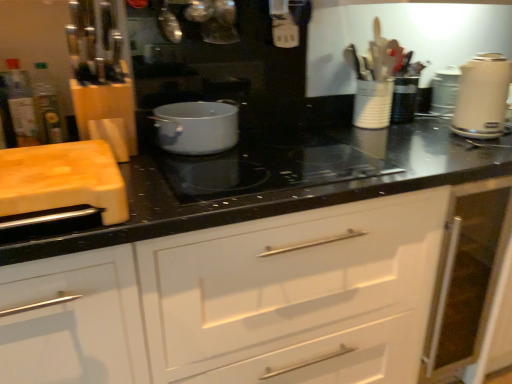
Identify the location of translucent glass bottle at left, the 2th bottle in the left-to-right sequence. The image size is (512, 384). (47, 104).

Identify the location of translucent plastic bottle at left, arranged as the 2th bottle when viewed from the right. This screenshot has width=512, height=384. (21, 105).

This screenshot has height=384, width=512. What do you see at coordinates (169, 24) in the screenshot?
I see `metallic silver kettle at upper center, which appears as the 1th appliance when viewed from the left` at bounding box center [169, 24].

Where is `black glass cooktop at center`? This screenshot has width=512, height=384. black glass cooktop at center is located at coordinates (268, 166).

Image resolution: width=512 pixels, height=384 pixels. What do you see at coordinates (268, 166) in the screenshot?
I see `black glass cooktop at center` at bounding box center [268, 166].

I want to click on wooden cutting board at left, so click(63, 180).

Is black glass cooktop at center at the back of translucent glass bottle at left, placed as the 1th bottle when sorted from right to left?

translucent glass bottle at left, placed as the 1th bottle when sorted from right to left, does not have its back to black glass cooktop at center.

Identify the location of the 1st bottle located above the black glass cooktop at center (from a real-world perspective). This screenshot has height=384, width=512. (47, 104).

Between translucent glass bottle at left, the 2th bottle in the left-to-right sequence, and black glass cooktop at center, which one is positioned behind?

translucent glass bottle at left, the 2th bottle in the left-to-right sequence.

Is translucent glass bottle at left, placed as the 1th bottle when sorted from right to left, completely or partially outside of black glass cooktop at center?

Indeed, translucent glass bottle at left, placed as the 1th bottle when sorted from right to left, is completely outside black glass cooktop at center.

From their relative heights in the image, would you say metallic silver kettle at upper center, positioned as the third appliance in back-to-front order, is taller or shorter than translucent glass bottle at left, the 2th bottle in the left-to-right sequence?

Clearly, metallic silver kettle at upper center, positioned as the third appliance in back-to-front order, is taller compared to translucent glass bottle at left, the 2th bottle in the left-to-right sequence.

Identify the location of bottle that is the 1st object to the left of the metallic silver kettle at upper center, positioned as the third appliance in back-to-front order, starting at the anchor. This screenshot has height=384, width=512. (47, 104).

In terms of width, does metallic silver kettle at upper center, arranged as the third appliance when viewed from the right, look wider or thinner when compared to translucent glass bottle at left, the 2th bottle in the left-to-right sequence?

In the image, metallic silver kettle at upper center, arranged as the third appliance when viewed from the right, appears to be wider than translucent glass bottle at left, the 2th bottle in the left-to-right sequence.

Is metallic silver kettle at upper center, which appears as the 1th appliance when viewed from the left, turned away from translucent glass bottle at left, placed as the 1th bottle when sorted from right to left?

That's not correct — metallic silver kettle at upper center, which appears as the 1th appliance when viewed from the left, is not looking away from translucent glass bottle at left, placed as the 1th bottle when sorted from right to left.

Who is taller, white glossy electric kettle at right, the 1th kitchen appliance positioned from the right, or black glass cooktop at center?

With more height is white glossy electric kettle at right, the 1th kitchen appliance positioned from the right.

Is white glossy electric kettle at right, which appears as the 2th kitchen appliance when viewed from the left, closer to the viewer compared to black glass cooktop at center?

No, it is not.

Can you confirm if wooden cutting board at left is wider than white plastic toaster at upper right, which ranks as the 3th appliance in left-to-right order?

Correct, the width of wooden cutting board at left exceeds that of white plastic toaster at upper right, which ranks as the 3th appliance in left-to-right order.

Looking at this image, considering the positions of objects wooden cutting board at left and white plastic toaster at upper right, arranged as the 1th appliance when viewed from the back, in the image provided, who is more to the left, wooden cutting board at left or white plastic toaster at upper right, arranged as the 1th appliance when viewed from the back,?

From the viewer's perspective, wooden cutting board at left appears more on the left side.

How much distance is there between wooden cutting board at left and white plastic toaster at upper right, which ranks as the 3th appliance in front-to-back order?

The distance of wooden cutting board at left from white plastic toaster at upper right, which ranks as the 3th appliance in front-to-back order, is 4.42 feet.

Is wooden cutting board at left facing towards white plastic toaster at upper right, which ranks as the 3th appliance in front-to-back order?

No, wooden cutting board at left is not facing towards white plastic toaster at upper right, which ranks as the 3th appliance in front-to-back order.

Is translucent glass bottle at left, placed as the 1th bottle when sorted from right to left, far away from matte white pot at center, placed as the first kitchen appliance when sorted from left to right?

No, translucent glass bottle at left, placed as the 1th bottle when sorted from right to left, is in close proximity to matte white pot at center, placed as the first kitchen appliance when sorted from left to right.

Considering the relative sizes of translucent glass bottle at left, the 2th bottle in the left-to-right sequence, and matte white pot at center, which appears as the second kitchen appliance when viewed from the right, in the image provided, is translucent glass bottle at left, the 2th bottle in the left-to-right sequence, wider than matte white pot at center, which appears as the second kitchen appliance when viewed from the right,?

Incorrect, the width of translucent glass bottle at left, the 2th bottle in the left-to-right sequence, does not surpass that of matte white pot at center, which appears as the second kitchen appliance when viewed from the right.

Can you confirm if translucent glass bottle at left, the 2th bottle in the left-to-right sequence, is taller than matte white pot at center, which appears as the second kitchen appliance when viewed from the right?

Yes, translucent glass bottle at left, the 2th bottle in the left-to-right sequence, is taller than matte white pot at center, which appears as the second kitchen appliance when viewed from the right.

From a real-world perspective, is white plastic toaster at upper right, which ranks as the 3th appliance in left-to-right order, positioned under translucent plastic bottle at left, arranged as the 2th bottle when viewed from the right, based on gravity?

Indeed, from a real-world perspective, white plastic toaster at upper right, which ranks as the 3th appliance in left-to-right order, is positioned beneath translucent plastic bottle at left, arranged as the 2th bottle when viewed from the right.

Considering the relative positions of white plastic toaster at upper right, which ranks as the 3th appliance in front-to-back order, and translucent plastic bottle at left, which appears as the 1th bottle when viewed from the left, in the image provided, is white plastic toaster at upper right, which ranks as the 3th appliance in front-to-back order, to the left or to the right of translucent plastic bottle at left, which appears as the 1th bottle when viewed from the left,?

In the image, white plastic toaster at upper right, which ranks as the 3th appliance in front-to-back order, appears on the right side of translucent plastic bottle at left, which appears as the 1th bottle when viewed from the left.

Is white plastic toaster at upper right, arranged as the 1th appliance when viewed from the back, outside of translucent plastic bottle at left, which appears as the 1th bottle when viewed from the left?

white plastic toaster at upper right, arranged as the 1th appliance when viewed from the back, is positioned outside translucent plastic bottle at left, which appears as the 1th bottle when viewed from the left.

Is white plastic toaster at upper right, which ranks as the 3th appliance in left-to-right order, positioned in front of translucent plastic bottle at left, which appears as the 1th bottle when viewed from the left?

No, it is not.

Can you confirm if white glossy electric kettle at right, which appears as the 2th kitchen appliance when viewed from the left, is bigger than white ceramic utensil holder at upper right, acting as the 2th appliance starting from the right?

Yes, white glossy electric kettle at right, which appears as the 2th kitchen appliance when viewed from the left, is bigger than white ceramic utensil holder at upper right, acting as the 2th appliance starting from the right.

Based on the photo, from a real-world perspective, between white glossy electric kettle at right, the 1th kitchen appliance positioned from the right, and white ceramic utensil holder at upper right, marked as the second appliance in a left-to-right arrangement, who is vertically higher?

white glossy electric kettle at right, the 1th kitchen appliance positioned from the right, from a real-world perspective.

Looking at this image, is white glossy electric kettle at right, the 1th kitchen appliance positioned from the right, at the left side of white ceramic utensil holder at upper right, acting as the 2th appliance starting from the right?

Incorrect, white glossy electric kettle at right, the 1th kitchen appliance positioned from the right, is not on the left side of white ceramic utensil holder at upper right, acting as the 2th appliance starting from the right.

Considering the points (492, 59) and (362, 117), which point is behind, point (492, 59) or point (362, 117)?

The point (492, 59) is more distant.

Which bottle is the 2nd one when counting from the back of the black glass cooktop at center? Please provide its 2D coordinates.

[(47, 104)]

From the image's perspective, which bottle is the 2nd one below the metallic silver kettle at upper center, positioned as the 1th appliance in front-to-back order? Please provide its 2D coordinates.

[(47, 104)]

When comparing their distances from metallic silver kettle at upper center, which appears as the 1th appliance when viewed from the left, does wooden cutting board at left or matte white pot at center, which appears as the second kitchen appliance when viewed from the right, seem further?

wooden cutting board at left is further to metallic silver kettle at upper center, which appears as the 1th appliance when viewed from the left.

Estimate the real-world distances between objects in this image. Which object is closer to white glossy electric kettle at right, which appears as the 2th kitchen appliance when viewed from the left, translucent plastic bottle at left, which appears as the 1th bottle when viewed from the left, or white glossy drawer at center?

white glossy drawer at center.

Which object lies nearer to the anchor point white glossy electric kettle at right, which appears as the 2th kitchen appliance when viewed from the left, black glass cooktop at center or matte white pot at center, which appears as the second kitchen appliance when viewed from the right?

black glass cooktop at center is positioned closer to the anchor white glossy electric kettle at right, which appears as the 2th kitchen appliance when viewed from the left.

When comparing their distances from black glass cooktop at center, does wooden cutting board at left or translucent plastic bottle at left, arranged as the 2th bottle when viewed from the right, seem closer?

wooden cutting board at left is closer to black glass cooktop at center.

Based on the photo, which object lies further to the anchor point metallic silver kettle at upper center, which appears as the 1th appliance when viewed from the left, wooden cutting board at left or white ceramic utensil holder at upper right, marked as the second appliance in a left-to-right arrangement?

white ceramic utensil holder at upper right, marked as the second appliance in a left-to-right arrangement, lies further to metallic silver kettle at upper center, which appears as the 1th appliance when viewed from the left, than the other object.

Which object lies further to the anchor point translucent glass bottle at left, placed as the 1th bottle when sorted from right to left, white plastic toaster at upper right, which ranks as the 3th appliance in front-to-back order, or translucent plastic bottle at left, arranged as the 2th bottle when viewed from the right?

Among the two, white plastic toaster at upper right, which ranks as the 3th appliance in front-to-back order, is located further to translucent glass bottle at left, placed as the 1th bottle when sorted from right to left.

From the image, which object appears to be farther from translucent plastic bottle at left, which appears as the 1th bottle when viewed from the left, white glossy drawer at center or translucent glass bottle at left, placed as the 1th bottle when sorted from right to left?

white glossy drawer at center.

Considering their positions, is black glass cooktop at center positioned further to translucent plastic bottle at left, arranged as the 2th bottle when viewed from the right, than white plastic toaster at upper right, which ranks as the 3th appliance in front-to-back order?

Based on the image, white plastic toaster at upper right, which ranks as the 3th appliance in front-to-back order, appears to be further to translucent plastic bottle at left, arranged as the 2th bottle when viewed from the right.

You are a GUI agent. You are given a task and a screenshot of the screen. Output one action in this format:
    pyautogui.click(x=<x>, y=<y>)
    Task: Click on the gas stove situated between translucent plastic bottle at left, which appears as the 1th bottle when viewed from the left, and white glossy drawer at center from left to right
    
    Given the screenshot: What is the action you would take?
    pyautogui.click(x=268, y=166)

Locate an element on the screen. The width and height of the screenshot is (512, 384). cabinetry between translucent plastic bottle at left, which appears as the 1th bottle when viewed from the left, and white glossy electric kettle at right, the 1th kitchen appliance positioned from the right, in the horizontal direction is located at coordinates (234, 302).

In order to click on kitchen appliance between translucent glass bottle at left, placed as the 1th bottle when sorted from right to left, and white glossy electric kettle at right, which appears as the 2th kitchen appliance when viewed from the left, in the horizontal direction in this screenshot , I will do `click(196, 127)`.

At what (x,y) coordinates should I click in order to perform the action: click on gas stove between metallic silver kettle at upper center, arranged as the third appliance when viewed from the right, and white glossy drawer at center, in the vertical direction. Please return your answer as a coordinate pair (x, y). Looking at the image, I should click on (268, 166).